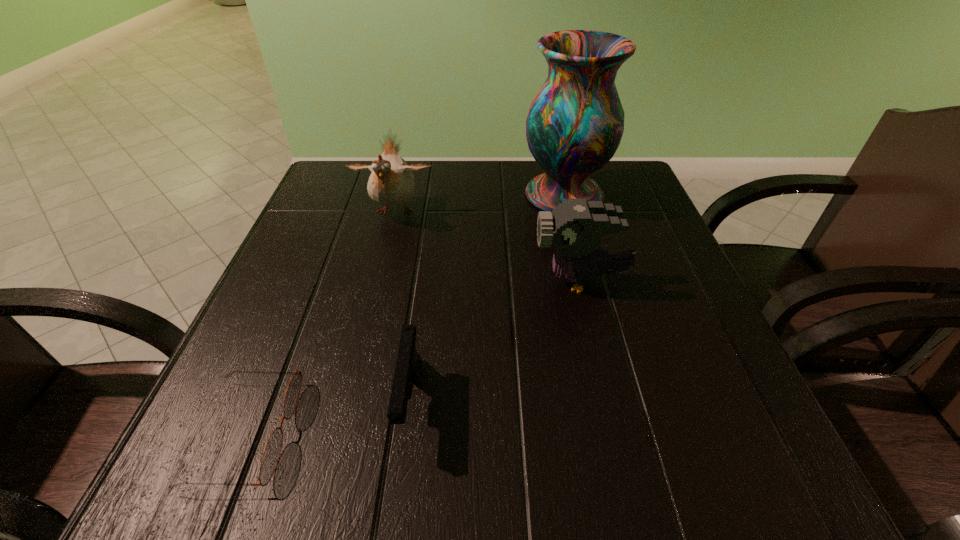
The width and height of the screenshot is (960, 540). I want to click on vase, so click(x=574, y=126).

Locate an element on the screen. The width and height of the screenshot is (960, 540). the farther bird is located at coordinates (391, 183).

You are a GUI agent. You are given a task and a screenshot of the screen. Output one action in this format:
    pyautogui.click(x=<x>, y=<y>)
    Task: Click on the third farthest object
    
    Given the screenshot: What is the action you would take?
    pyautogui.click(x=575, y=228)

You are a GUI agent. You are given a task and a screenshot of the screen. Output one action in this format:
    pyautogui.click(x=<x>, y=<y>)
    Task: Click on the nearer bird
    Image resolution: width=960 pixels, height=540 pixels.
    Given the screenshot: What is the action you would take?
    pyautogui.click(x=575, y=228)

At what (x,y) coordinates should I click in order to perform the action: click on the fourth tallest object. Please return your answer as a coordinate pair (x, y). This screenshot has height=540, width=960. Looking at the image, I should click on (407, 369).

Image resolution: width=960 pixels, height=540 pixels. Find the location of `the shortest object`. the shortest object is located at coordinates (272, 451).

Identify the location of free space located on the front of the tallest object. This screenshot has height=540, width=960. (574, 233).

You are a GUI agent. You are given a task and a screenshot of the screen. Output one action in this format:
    pyautogui.click(x=<x>, y=<y>)
    Task: Click on the vacant space located at the beak of the left bird
    Image resolution: width=960 pixels, height=540 pixels.
    Given the screenshot: What is the action you would take?
    pyautogui.click(x=361, y=352)

At what (x,y) coordinates should I click in order to perform the action: click on vacant area situated at the beak of the nearer bird. Please return your answer as a coordinate pair (x, y). This screenshot has width=960, height=540. Looking at the image, I should click on (387, 281).

The image size is (960, 540). I want to click on free spot located 0.070m at the beak of the nearer bird, so click(x=496, y=281).